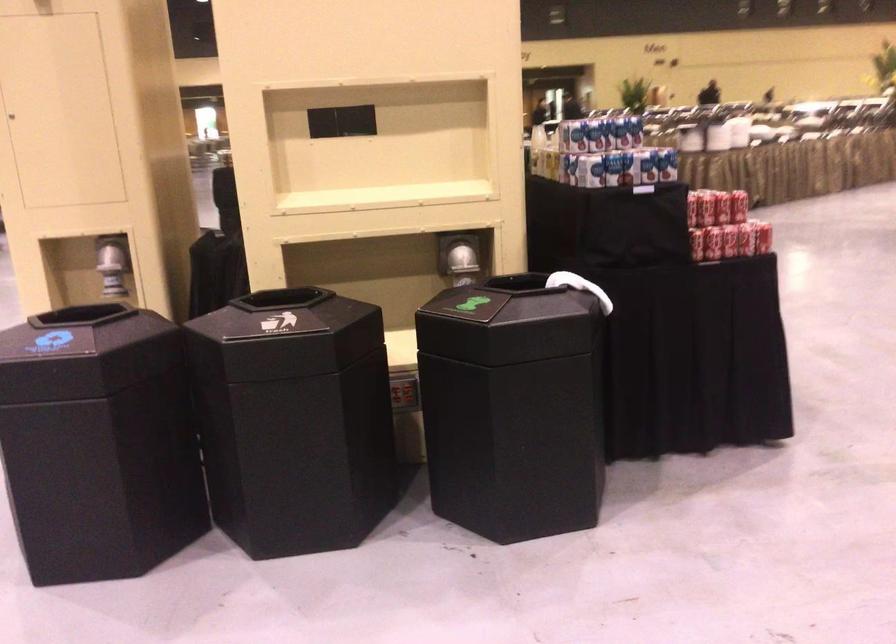
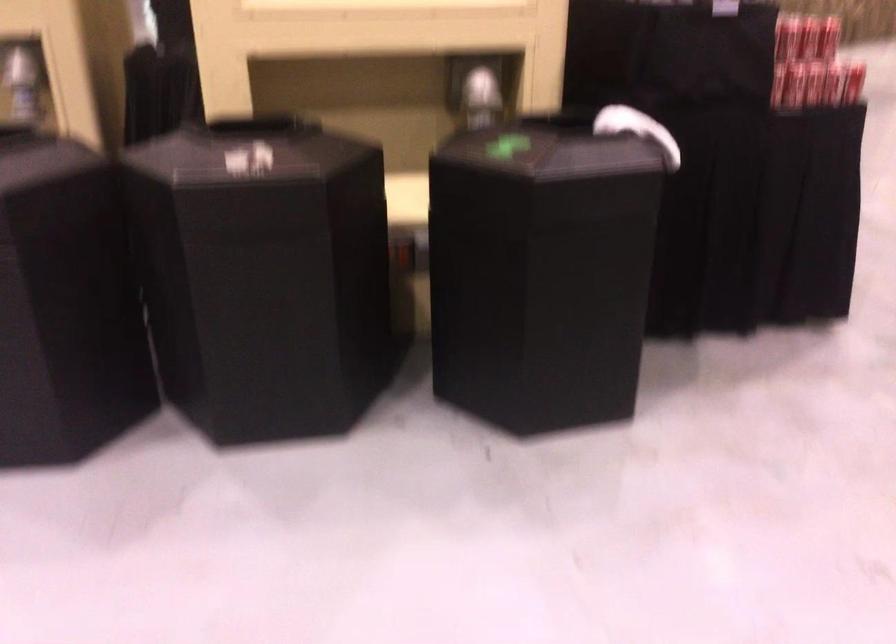
Find the pixel in the second image that matches point (745, 243) in the first image.

(833, 84)